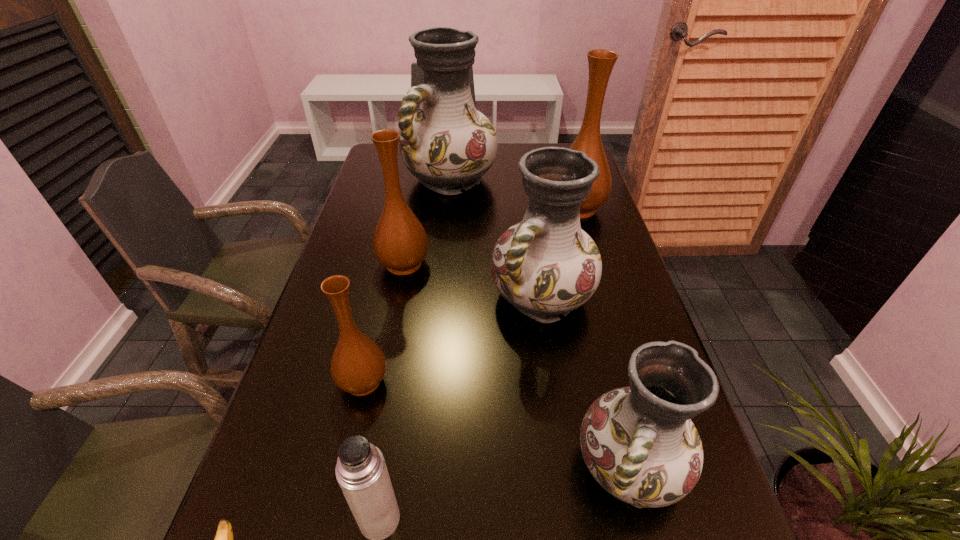
Identify the location of vacant space located 0.390m on the left of the biggest brown vase. This screenshot has height=540, width=960. (424, 208).

Identify the location of vacant space located 0.280m on the back of the second biggest red vase. (528, 205).

At what (x,y) coordinates should I click in order to perform the action: click on blank space located 0.190m on the back of the second farthest brown vase. Please return your answer as a coordinate pair (x, y). The height and width of the screenshot is (540, 960). Looking at the image, I should click on (415, 210).

At what (x,y) coordinates should I click in order to perform the action: click on vacant area situated 0.170m on the right of the second nearest vase. Please return your answer as a coordinate pair (x, y). Looking at the image, I should click on (472, 381).

I want to click on vacant area situated 0.370m on the back of the nearest red vase, so click(584, 284).

Identify the location of object that is at the far edge. This screenshot has height=540, width=960. (447, 144).

Where is `object at the far left corner`? object at the far left corner is located at coordinates (447, 144).

This screenshot has height=540, width=960. Find the location of `vacant space at the left edge`. vacant space at the left edge is located at coordinates (361, 321).

This screenshot has height=540, width=960. What are the coordinates of `vacant space at the right edge of the desktop` in the screenshot? It's located at (636, 329).

Identify the location of free spot between the nearest red vase and the rightmost brown vase. (604, 338).